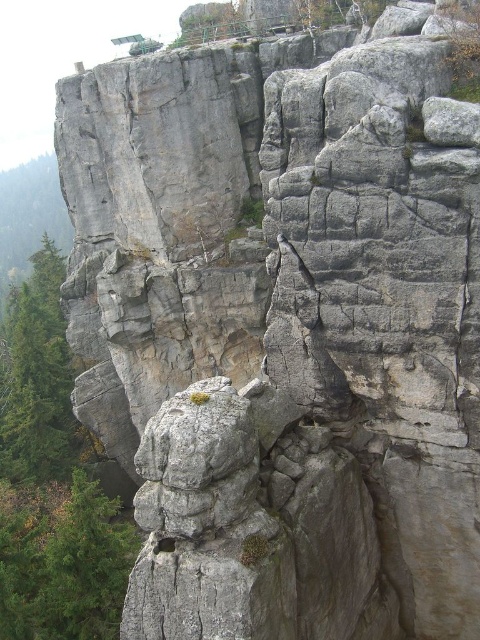
You are standing at the base of the cliff and notice a green rough tree at lower left. Based on its coordinates, is it closer to the bottom or the top of the image?

The green rough tree at lower left is located at point 0.881 on the x axis and 0.131 on the y axis. Since the y coordinate is closer to 0, it is closer to the bottom of the image.

You are a hiker who wants to plant a new tree between the green rough tree at lower left and the green rough tree at left. The new tree requires a space of 20 meters between the existing trees. Do you think you can plant it there?

The green rough tree at lower left and green rough tree at left are 19.65 meters apart from each other. Since the required space is 20 meters, the distance is insufficient, so you cannot plant the new tree there.